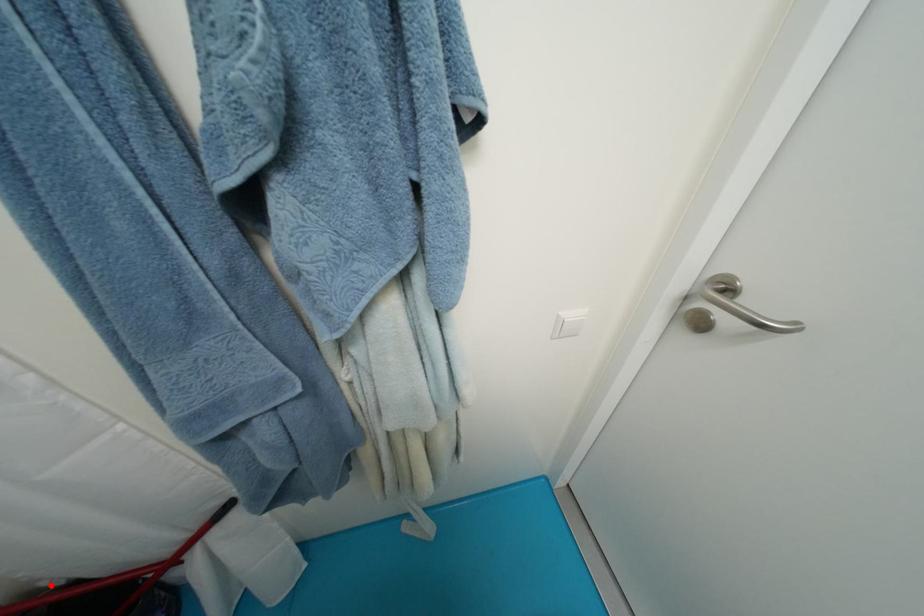
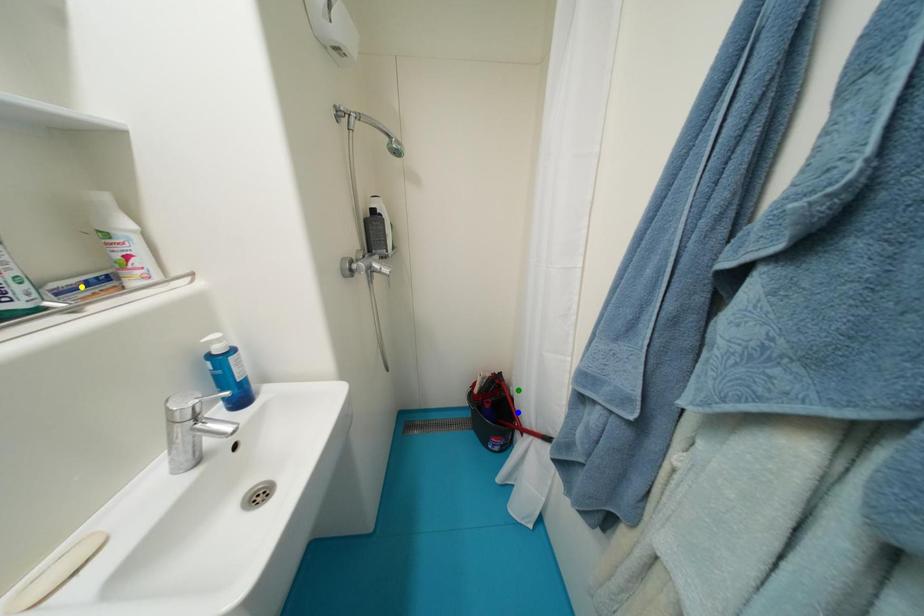
Question: I am providing you with two images of the same scene from different viewpoints. A red point is marked on the first image. You are given multiple points on the second image. Which spot in image 2 lines up with the point in image 1?

Choices:
 (A) green point
 (B) blue point
 (C) yellow point

Answer: (A)